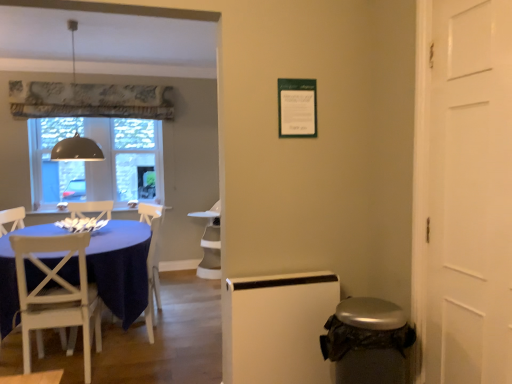
This screenshot has height=384, width=512. Describe the element at coordinates (120, 267) in the screenshot. I see `blue fabric table at left` at that location.

Locate an element on the screen. Image resolution: width=512 pixels, height=384 pixels. clear glass window at center is located at coordinates (136, 158).

What do you see at coordinates (136, 158) in the screenshot? This screenshot has height=384, width=512. I see `clear glass window at center` at bounding box center [136, 158].

Measure the distance between point (159, 234) and camera.

Point (159, 234) is 4.91 meters from camera.

Where is `white wood chair at left, the 1th armchair viewed from the front`? The image size is (512, 384). white wood chair at left, the 1th armchair viewed from the front is located at coordinates (152, 262).

Image resolution: width=512 pixels, height=384 pixels. I want to click on white wood chair at left, so click(57, 295).

From the image's perspective, is clear glass window at center above or below matte gray dome at upper left?

Based on their image positions, clear glass window at center is located beneath matte gray dome at upper left.

Is clear glass window at center bigger than matte gray dome at upper left?

No, clear glass window at center is not bigger than matte gray dome at upper left.

Is clear glass window at center far away from matte gray dome at upper left?

That's right, there is a large distance between clear glass window at center and matte gray dome at upper left.

Which object is further away from the camera taking this photo, clear glass window at center or matte gray dome at upper left?

clear glass window at center is further from the camera.

Considering their positions, is white glossy armchair at center, which ranks as the second armchair in front-to-back order, located in front of or behind clear glass window at center?

Visually, white glossy armchair at center, which ranks as the second armchair in front-to-back order, is located in front of clear glass window at center.

What's the angular difference between white glossy armchair at center, which ranks as the second armchair in front-to-back order, and clear glass window at center's facing directions?

There is a 1.87-degree angle between the facing directions of white glossy armchair at center, which ranks as the second armchair in front-to-back order, and clear glass window at center.

From the image's perspective, which object appears higher, white glossy armchair at center, which ranks as the 1th armchair in back-to-front order, or clear glass window at center?

clear glass window at center is shown above in the image.

Which object is thinner, white glossy armchair at center, which ranks as the second armchair in front-to-back order, or clear glass window at center?

clear glass window at center.

Is white glossy armchair at center, which ranks as the 1th armchair in back-to-front order, turned away from white wood chair at left?

No, white wood chair at left is not at the back of white glossy armchair at center, which ranks as the 1th armchair in back-to-front order.

This screenshot has height=384, width=512. I want to click on chair in front of the white glossy armchair at center, which ranks as the second armchair in front-to-back order, so click(x=57, y=295).

Which object is positioned more to the left, white glossy armchair at center, which ranks as the 1th armchair in back-to-front order, or white wood chair at left?

Positioned to the left is white wood chair at left.

From the image's perspective, relative to white wood chair at left, is white glossy armchair at center, which ranks as the second armchair in front-to-back order, above or below?

white glossy armchair at center, which ranks as the second armchair in front-to-back order, is above white wood chair at left.

From the picture: Is clear glass window at center in contact with white glossy armchair at center, which ranks as the second armchair in front-to-back order?

No, clear glass window at center is not with white glossy armchair at center, which ranks as the second armchair in front-to-back order.

Considering the points (158, 139) and (208, 210), which point is in front, point (158, 139) or point (208, 210)?

The point (158, 139) is closer.

Between clear glass window at center and white glossy armchair at center, which ranks as the second armchair in front-to-back order, which one has smaller width?

clear glass window at center is thinner.

Is white wood chair at left, the 1th armchair viewed from the front, beside white glossy armchair at center, which ranks as the 1th armchair in back-to-front order?

No, white wood chair at left, the 1th armchair viewed from the front, is not in contact with white glossy armchair at center, which ranks as the 1th armchair in back-to-front order.

Visually, is white wood chair at left, the 1th armchair viewed from the front, positioned to the left or to the right of white glossy armchair at center, which ranks as the 1th armchair in back-to-front order?

white wood chair at left, the 1th armchair viewed from the front, is positioned on white glossy armchair at center, which ranks as the 1th armchair in back-to-front order,'s left side.

Can you confirm if white wood chair at left, which ranks as the second armchair in back-to-front order, is taller than white glossy armchair at center, which ranks as the second armchair in front-to-back order?

No, white wood chair at left, which ranks as the second armchair in back-to-front order, is not taller than white glossy armchair at center, which ranks as the second armchair in front-to-back order.

In the scene shown: From a real-world perspective, is blue fabric table at left positioned over matte gray dome at upper left based on gravity?

Incorrect, from a real-world perspective, blue fabric table at left is lower than matte gray dome at upper left.

Locate an element on the screen. The image size is (512, 384). kitchen & dining room table lying below the matte gray dome at upper left (from the image's perspective) is located at coordinates pos(120,267).

From the image's perspective, does blue fabric table at left appear higher than matte gray dome at upper left?

No.

Is blue fabric table at left taller or shorter than matte gray dome at upper left?

In the image, blue fabric table at left appears to be shorter than matte gray dome at upper left.

Based on their positions, is clear glass window at center located to the left or right of blue fabric table at left?

clear glass window at center is to the left of blue fabric table at left.

Considering the relative sizes of clear glass window at center and blue fabric table at left in the image provided, is clear glass window at center shorter than blue fabric table at left?

In fact, clear glass window at center may be taller than blue fabric table at left.

From the image's perspective, who appears lower, clear glass window at center or blue fabric table at left?

blue fabric table at left, from the image's perspective.

From a real-world perspective, is clear glass window at center located higher than blue fabric table at left?

Yes, from a real-world perspective, clear glass window at center is above blue fabric table at left.

The image size is (512, 384). I want to click on glass door to the left of matte gray dome at upper left, so click(x=136, y=158).

From a real-world perspective, starting from the clear glass window at center, which armchair is the 1st one below it? Please provide its 2D coordinates.

[(210, 243)]

Looking at this image, considering their positions, is white wood chair at left, which ranks as the second armchair in back-to-front order, positioned further to blue fabric table at left than white wood chair at left?

Based on the image, white wood chair at left, which ranks as the second armchair in back-to-front order, appears to be further to blue fabric table at left.

Which object lies nearer to the anchor point white wood chair at left, matte gray dome at upper left or white glossy armchair at center, which ranks as the second armchair in front-to-back order?

Among the two, matte gray dome at upper left is located nearer to white wood chair at left.

From the image, which object appears to be farther from white wood chair at left, the 1th armchair viewed from the front, matte gray dome at upper left or blue fabric table at left?

matte gray dome at upper left lies further to white wood chair at left, the 1th armchair viewed from the front, than the other object.

Based on their spatial positions, is white wood chair at left, the 1th armchair viewed from the front, or white wood chair at left further from clear glass window at center?

white wood chair at left lies further to clear glass window at center than the other object.

Consider the image. From the image, which object appears to be farther from white glossy armchair at center, which ranks as the second armchair in front-to-back order, white wood chair at left, which ranks as the second armchair in back-to-front order, or blue fabric table at left?

Based on the image, blue fabric table at left appears to be further to white glossy armchair at center, which ranks as the second armchair in front-to-back order.

From the picture: When comparing their distances from blue fabric table at left, does clear glass window at center or matte gray dome at upper left seem further?

clear glass window at center is further to blue fabric table at left.

From the image, which object appears to be farther from white wood chair at left, which ranks as the second armchair in back-to-front order, white wood chair at left or blue fabric table at left?

white wood chair at left is further to white wood chair at left, which ranks as the second armchair in back-to-front order.

Considering their positions, is blue fabric table at left positioned further to white wood chair at left than clear glass window at center?

Among the two, clear glass window at center is located further to white wood chair at left.

Find the location of a particular element. The image size is (512, 384). armchair located between matte gray dome at upper left and clear glass window at center in the depth direction is located at coordinates (210, 243).

This screenshot has width=512, height=384. Find the location of `kitchen & dining room table between matte gray dome at upper left and white wood chair at left in the vertical direction`. kitchen & dining room table between matte gray dome at upper left and white wood chair at left in the vertical direction is located at coordinates (120, 267).

Image resolution: width=512 pixels, height=384 pixels. Find the location of `kitchen & dining room table between white wood chair at left and clear glass window at center from front to back`. kitchen & dining room table between white wood chair at left and clear glass window at center from front to back is located at coordinates (120, 267).

What are the coordinates of `armchair positioned between blue fabric table at left and white glossy armchair at center, which ranks as the second armchair in front-to-back order, from near to far` in the screenshot? It's located at (152, 262).